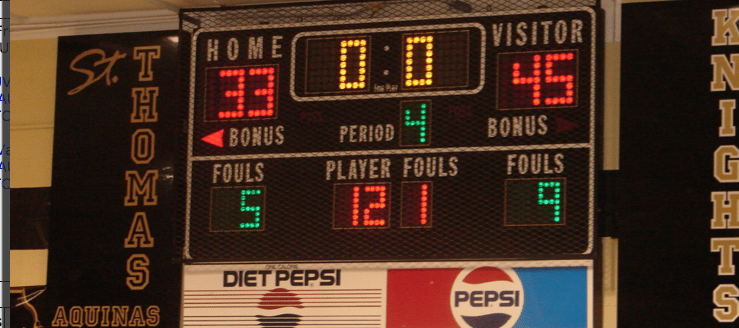
Where is `wall`? wall is located at coordinates (29, 78).